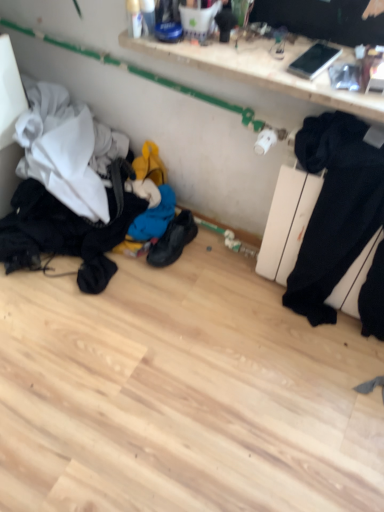
Find the location of a particular element. free spot to the right of black leather shoes at center is located at coordinates (215, 262).